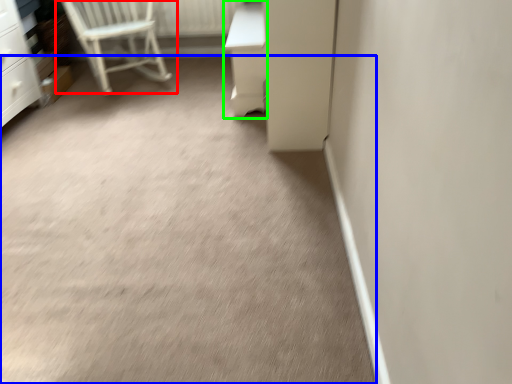
Question: Based on their relative distances, which object is farther from chair (highlighted by a red box)? Choose from concrete (highlighted by a blue box) and vanity (highlighted by a green box).

Choices:
 (A) concrete
 (B) vanity

Answer: (A)